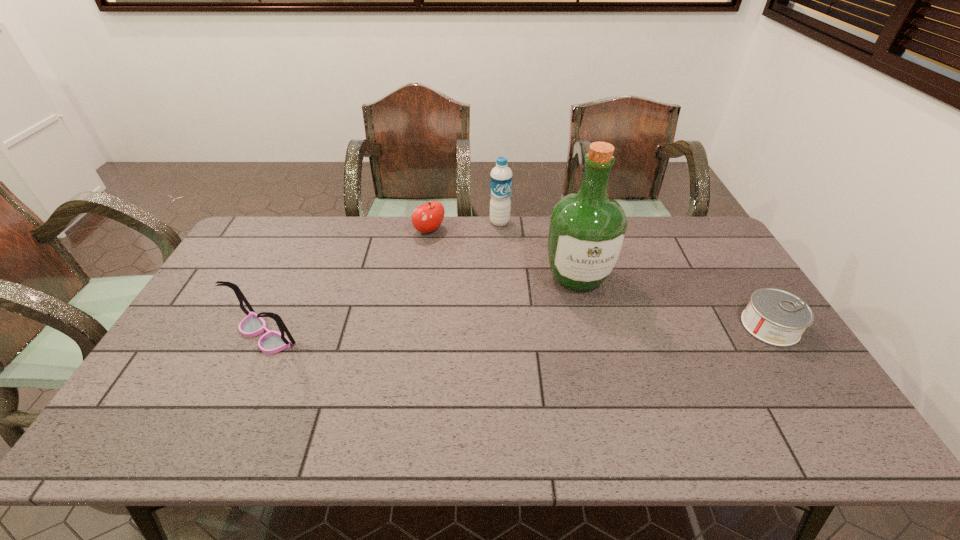
The width and height of the screenshot is (960, 540). In the image, there is a desktop. Find the location of `vacant space at the near left corner`. vacant space at the near left corner is located at coordinates (199, 408).

Identify the location of vacant position at the far right corner of the desktop. The width and height of the screenshot is (960, 540). (688, 238).

I want to click on free space that is in between the third object from right to left and the apple, so click(465, 226).

The height and width of the screenshot is (540, 960). What are the coordinates of `empty location between the second tallest object and the fourth tallest object` in the screenshot? It's located at (465, 226).

The width and height of the screenshot is (960, 540). What are the coordinates of `free area in between the third shortest object and the second tallest object` in the screenshot? It's located at (382, 278).

Identify the location of free space between the liquor and the apple. point(503,254).

Image resolution: width=960 pixels, height=540 pixels. I want to click on free space between the fourth object from left to right and the apple, so click(503, 254).

This screenshot has width=960, height=540. Identify the location of free spot between the fourth object from right to left and the tallest object. (503, 254).

Image resolution: width=960 pixels, height=540 pixels. What are the coordinates of `vacant space that's between the third object from right to left and the second shortest object` in the screenshot? It's located at (465, 226).

At what (x,y) coordinates should I click in order to perform the action: click on free space that is in between the water bottle and the shortest object. Please return your answer as a coordinate pair (x, y). The height and width of the screenshot is (540, 960). Looking at the image, I should click on (635, 274).